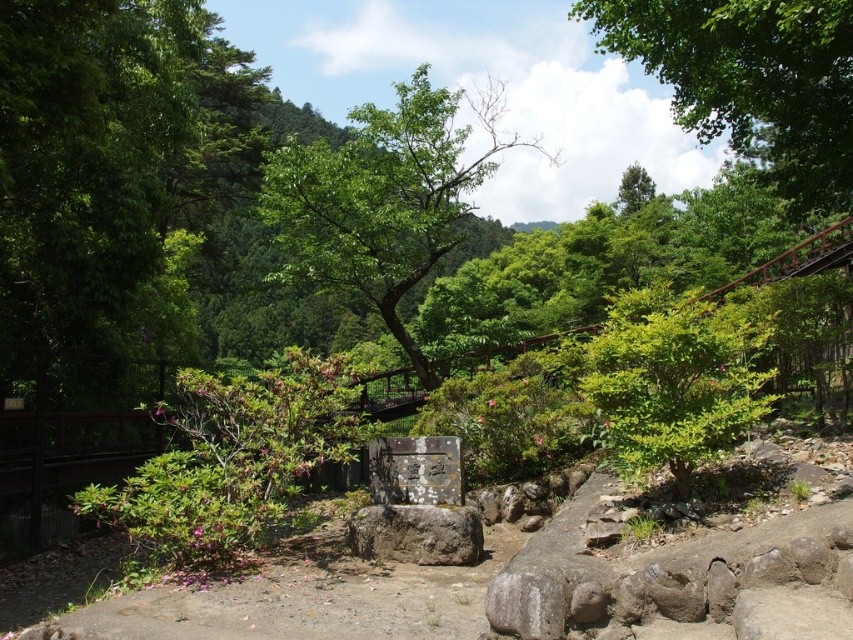
Find the location of a particular element. The image size is (853, 640). green leafy bush at center is located at coordinates (674, 380).

Describe the element at coordinates (674, 380) in the screenshot. I see `green leafy bush at center` at that location.

Is point (769, 333) behind point (448, 508)?

No, (769, 333) is in front of (448, 508).

Find the location of a particular element. This screenshot has height=640, width=853. green leafy bush at center is located at coordinates [674, 380].

Does green leafy tree at center appear on the right side of gray stone boulder at center?

Indeed, green leafy tree at center is positioned on the right side of gray stone boulder at center.

Which of these two, green leafy tree at center or gray stone boulder at center, stands taller?

green leafy tree at center is taller.

Is point (271, 189) positioned behind point (430, 557)?

Yes.

This screenshot has width=853, height=640. In order to click on green leafy tree at center in this screenshot , I will do `click(381, 198)`.

Is green leafy tree at center thinner than green leafy tree at upper center?

No.

The image size is (853, 640). Find the location of `green leafy tree at center`. green leafy tree at center is located at coordinates (381, 198).